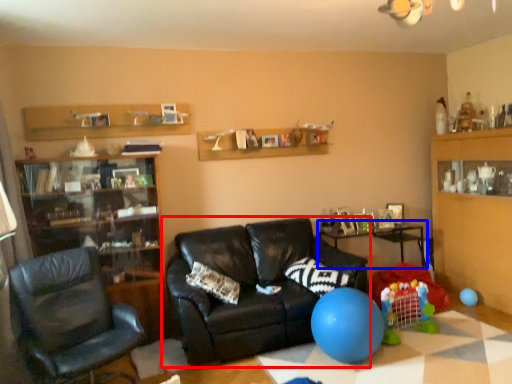
Question: Which of the following is the farthest to the observer, studio couch (highlighted by a red box) or table (highlighted by a blue box)?

Choices:
 (A) studio couch
 (B) table

Answer: (B)